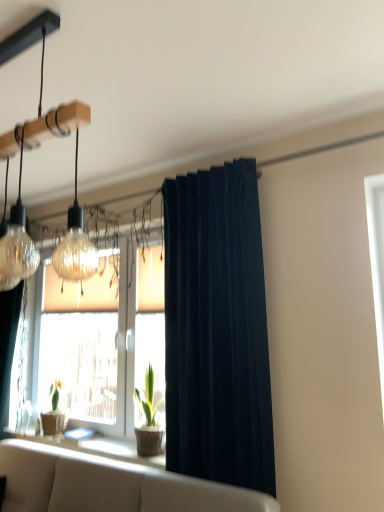
Question: Considering the relative sizes of green matte plant at center and dark blue velvet curtain at center in the image provided, is green matte plant at center shorter than dark blue velvet curtain at center?

Choices:
 (A) no
 (B) yes

Answer: (B)

Question: Is green matte plant at center smaller than dark blue velvet curtain at center?

Choices:
 (A) yes
 (B) no

Answer: (A)

Question: From the image's perspective, does green matte plant at center appear lower than dark blue velvet curtain at center?

Choices:
 (A) no
 (B) yes

Answer: (B)

Question: Could dark blue velvet curtain at center be considered to be inside green matte plant at center?

Choices:
 (A) yes
 (B) no

Answer: (B)

Question: From a real-world perspective, is green matte plant at center beneath dark blue velvet curtain at center?

Choices:
 (A) yes
 (B) no

Answer: (A)

Question: Considering the relative positions of green matte plant at center and dark blue velvet curtain at center in the image provided, is green matte plant at center behind dark blue velvet curtain at center?

Choices:
 (A) no
 (B) yes

Answer: (B)

Question: Is green matte plant at center thinner than wooden textured window sill at lower center?

Choices:
 (A) no
 (B) yes

Answer: (B)

Question: Is green matte plant at center positioned with its back to wooden textured window sill at lower center?

Choices:
 (A) no
 (B) yes

Answer: (A)

Question: Are green matte plant at center and wooden textured window sill at lower center located far from each other?

Choices:
 (A) yes
 (B) no

Answer: (B)

Question: Considering the relative sizes of green matte plant at center and wooden textured window sill at lower center in the image provided, is green matte plant at center shorter than wooden textured window sill at lower center?

Choices:
 (A) yes
 (B) no

Answer: (B)

Question: Is green matte plant at center directly adjacent to wooden textured window sill at lower center?

Choices:
 (A) no
 (B) yes

Answer: (A)

Question: Is green matte plant at center wider than wooden textured window sill at lower center?

Choices:
 (A) yes
 (B) no

Answer: (B)

Question: Considering the relative positions of dark blue velvet curtain at center and wooden textured window sill at lower center in the image provided, is dark blue velvet curtain at center to the left of wooden textured window sill at lower center from the viewer's perspective?

Choices:
 (A) yes
 (B) no

Answer: (B)